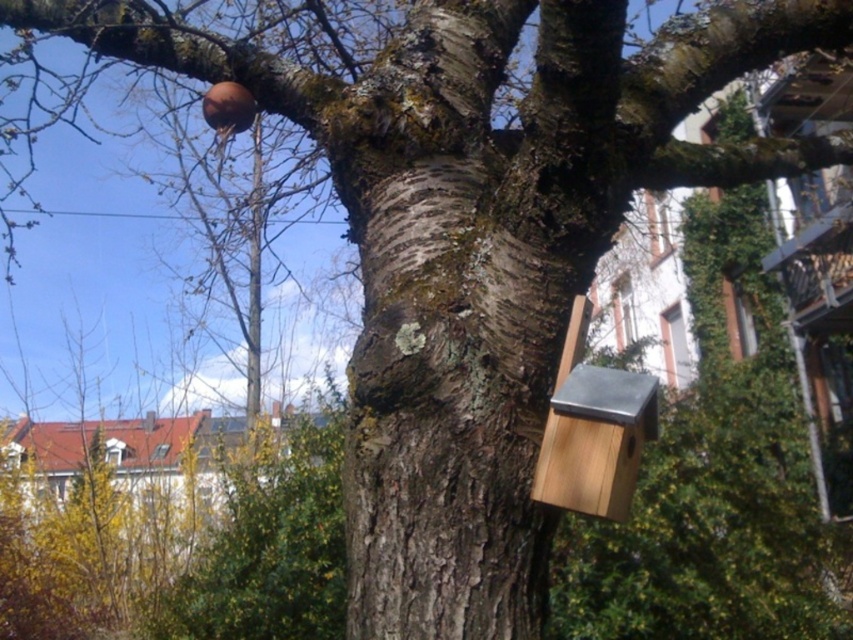
You are standing in front of a tree trunk with a birdhouse. There is a point at coordinates (451, 384). What object is located at that point?

The smooth bark tree trunk at center is located at point (451, 384).

Consider the image. You are standing at the origin point in the image. Which direction should you move to reach the smooth bark tree trunk at center?

The smooth bark tree trunk at center is located at point 0.600 in the x direction and 0.531 in the y direction, so you should move right and up to reach it.

You are standing in front of the tree trunk with the birdhouse. There are two points marked on the image at coordinates point (509, 557) and point (654, 404). Which point is closer to you?

Point (509, 557) is in front of point (654, 404), so it is closer to you.